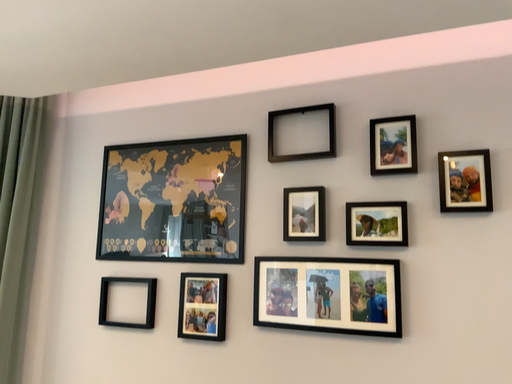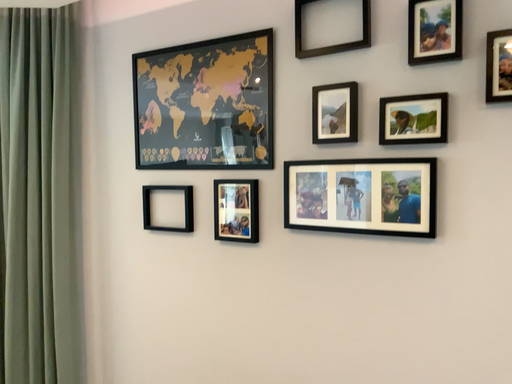
Question: How did the camera likely rotate when shooting the video?

Choices:
 (A) rotated upward
 (B) rotated downward

Answer: (B)